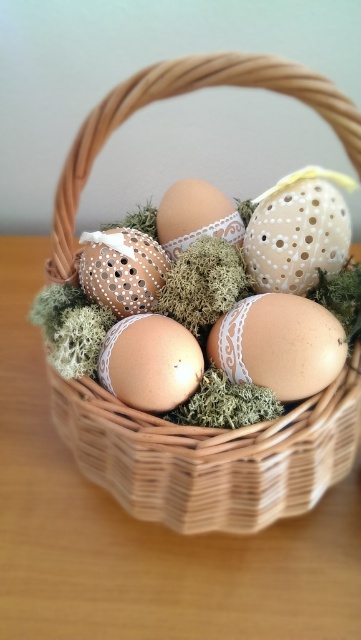
Question: Is wooden table at center below matte white egg at center?

Choices:
 (A) no
 (B) yes

Answer: (B)

Question: Which is nearer to the wooden table at center?

Choices:
 (A) matte white egg at center
 (B) woven wood basket at center

Answer: (B)

Question: Does woven wood basket at center appear over matte brown egg at center?

Choices:
 (A) no
 (B) yes

Answer: (B)

Question: Which point is farther to the camera?

Choices:
 (A) (332, 582)
 (B) (355, 390)
 (C) (181, 234)
 (D) (159, 352)

Answer: (C)

Question: Can you confirm if wooden table at center is smaller than woven wood basket at center?

Choices:
 (A) no
 (B) yes

Answer: (A)

Question: Which object is the farthest from the matte white egg at center?

Choices:
 (A) matte brown egg at center
 (B) matte white lace egg at center

Answer: (A)